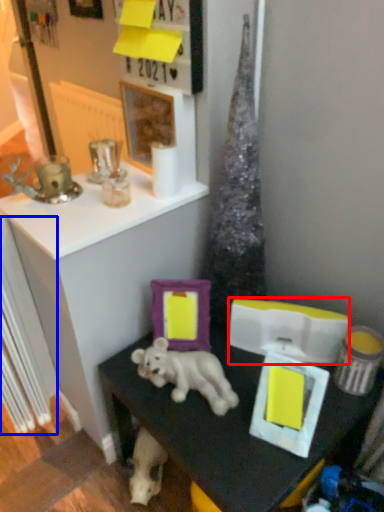
Question: Which point is closer to the camera, box (highlighted by a red box) or radiator (highlighted by a blue box)?

Choices:
 (A) box
 (B) radiator

Answer: (B)